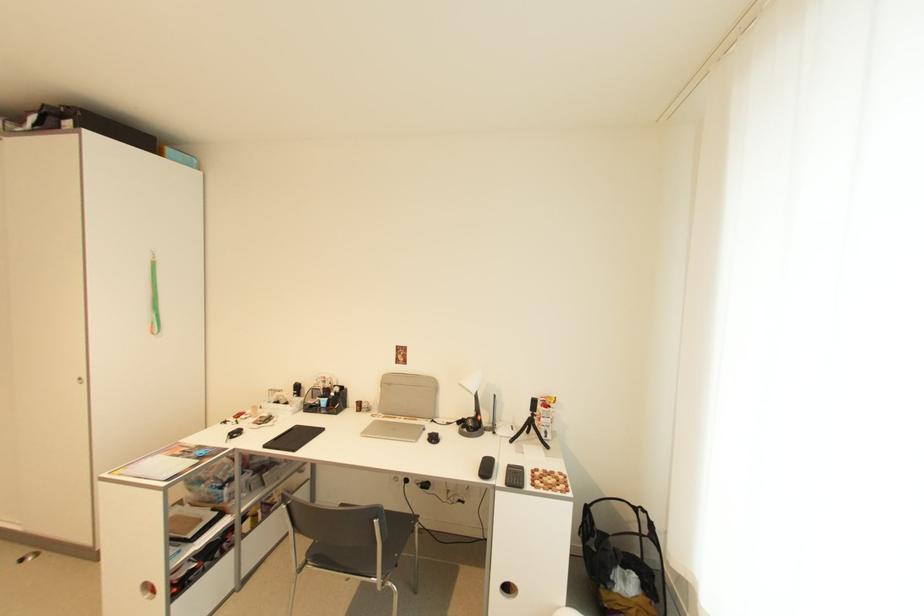
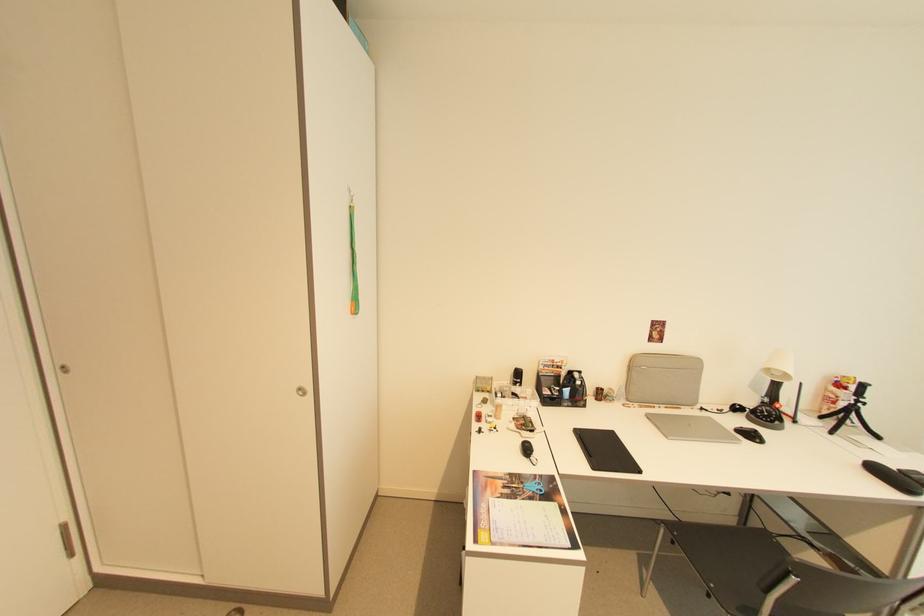
In a continuous first-person perspective shot, in which direction is the camera moving?

The cameraman moved toward left, forward.